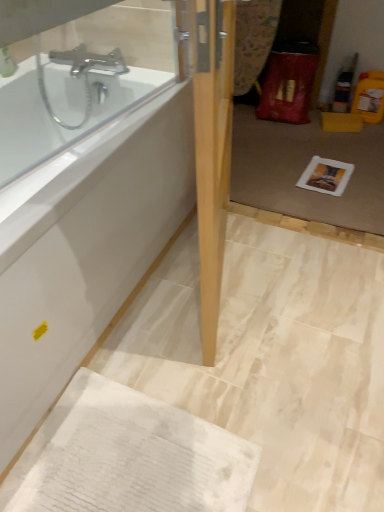
Find the location of `free spot to the right of light wood door at center`. free spot to the right of light wood door at center is located at coordinates (295, 286).